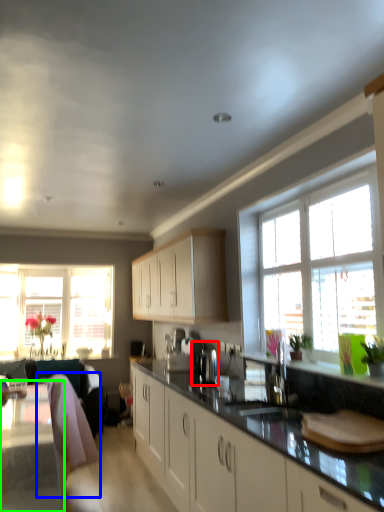
Question: Which object is positioned farthest from coffee machine (highlighted by a red box)? Select from swivel chair (highlighted by a blue box) and table (highlighted by a green box).

Choices:
 (A) swivel chair
 (B) table

Answer: (B)